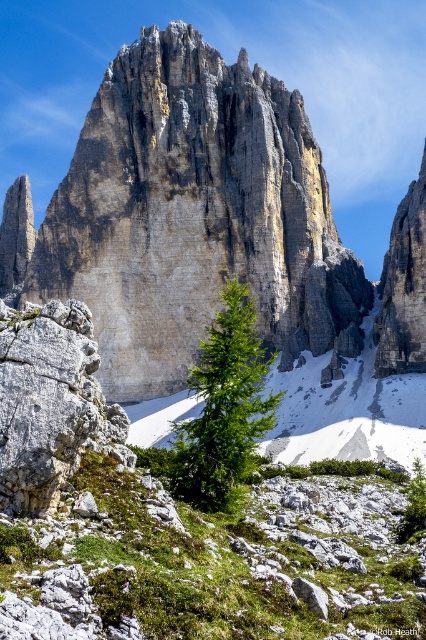
Is the position of gray stone mountain at center more distant than that of gray rough rock at lower left?

Yes, it is behind gray rough rock at lower left.

This screenshot has height=640, width=426. What do you see at coordinates (192, 216) in the screenshot?
I see `gray stone mountain at center` at bounding box center [192, 216].

The image size is (426, 640). What are the coordinates of `gray stone mountain at center` in the screenshot? It's located at (192, 216).

Which is in front, point (19, 433) or point (224, 326)?

Positioned in front is point (19, 433).

Can you confirm if gray rough rock at lower left is positioned to the right of green matte tree at center?

Incorrect, gray rough rock at lower left is not on the right side of green matte tree at center.

This screenshot has width=426, height=640. In order to click on gray rough rock at lower left in this screenshot , I will do `click(49, 403)`.

Can you confirm if gray stone mountain at center is positioned to the right of green matte tree at center?

In fact, gray stone mountain at center is to the left of green matte tree at center.

Who is more distant from viewer, (101, 116) or (253, 419)?

Point (101, 116)

Image resolution: width=426 pixels, height=640 pixels. I want to click on gray stone mountain at center, so click(192, 216).